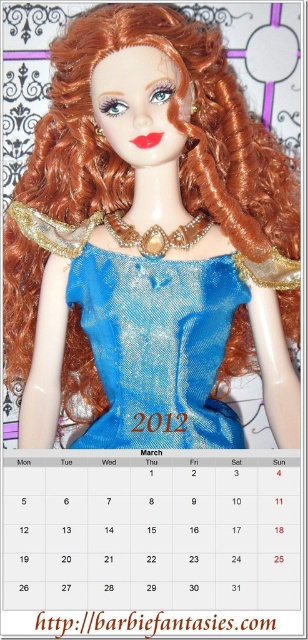
Question: Does shiny blue dress at center appear on the left side of blue sequined dress at center?

Choices:
 (A) yes
 (B) no

Answer: (A)

Question: Can you confirm if shiny blue dress at center is thinner than blue sequined dress at center?

Choices:
 (A) no
 (B) yes

Answer: (A)

Question: Which point is farther to the camera?

Choices:
 (A) (191, 339)
 (B) (137, 328)

Answer: (A)

Question: Observing the image, what is the correct spatial positioning of shiny blue dress at center in reference to blue sequined dress at center?

Choices:
 (A) above
 (B) below

Answer: (A)